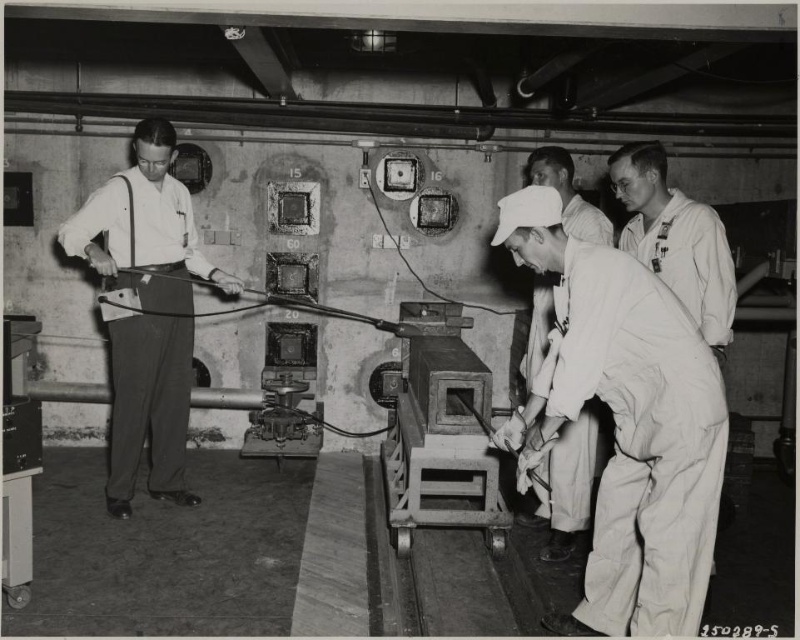
Question: Considering the real-world distances, which object is closest to the white fabric uniform at center?

Choices:
 (A) white matte shirt at left
 (B) white cotton overalls at center
 (C) white cotton shirt at center

Answer: (C)

Question: Does white fabric uniform at center appear on the left side of white cotton shirt at center?

Choices:
 (A) yes
 (B) no

Answer: (B)

Question: Among these points, which one is farthest from the camera?

Choices:
 (A) (558, 548)
 (B) (152, 193)
 (C) (694, 580)
 (D) (654, 166)

Answer: (B)

Question: Can you confirm if white matte shirt at left is wider than white fabric uniform at center?

Choices:
 (A) yes
 (B) no

Answer: (A)

Question: Which point is farther from the camera taking this photo?

Choices:
 (A) (180, 387)
 (B) (546, 554)

Answer: (A)

Question: Does white cotton overalls at center appear over white matte shirt at left?

Choices:
 (A) no
 (B) yes

Answer: (A)